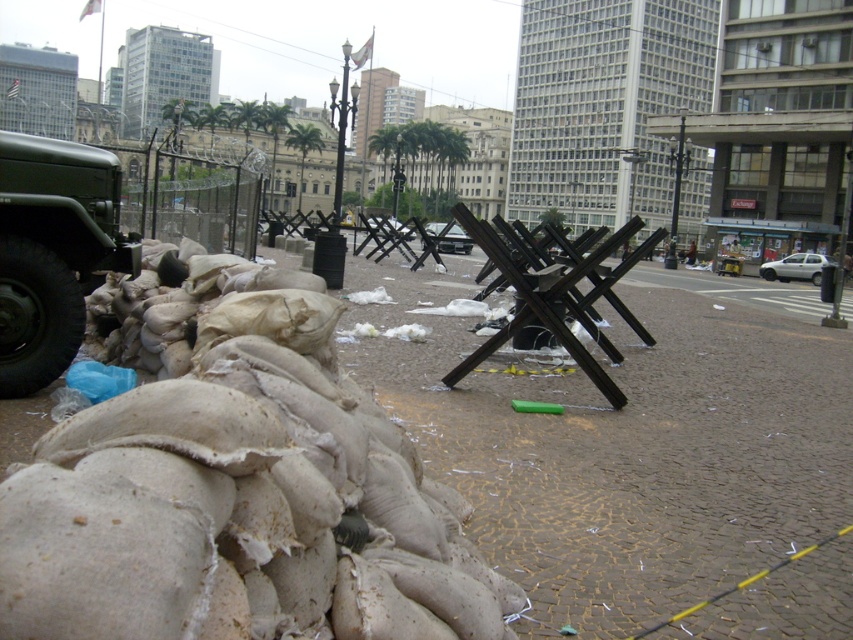
You are a photographer trying to capture both the matte green military vehicle at left and the metallic silver car at center in a single frame. Which vehicle should you focus on first to ensure both are in the frame?

You should focus on the metallic silver car at center first since it is larger than the matte green military vehicle at left, allowing you to position it in the frame while still accommodating the smaller vehicle.

From the picture: You are a pedestrian standing in the middle of the road. You see a matte green military vehicle at left and a metallic silver car at center. Which vehicle is closer to you?

The matte green military vehicle at left is closer to you because it is in front of the metallic silver car at center.

You are a parking attendant and need to fit both the white matte car at right and the metallic silver car at center into a parking spot that is 2 meters wide. Can both cars fit side by side in the spot?

The white matte car at right is wider than the metallic silver car at center. Since the parking spot is only 2 meters wide, it depends on the exact widths of both cars. If their combined widths are less than or equal to 2 meters, they can fit, but if not, they cannot.